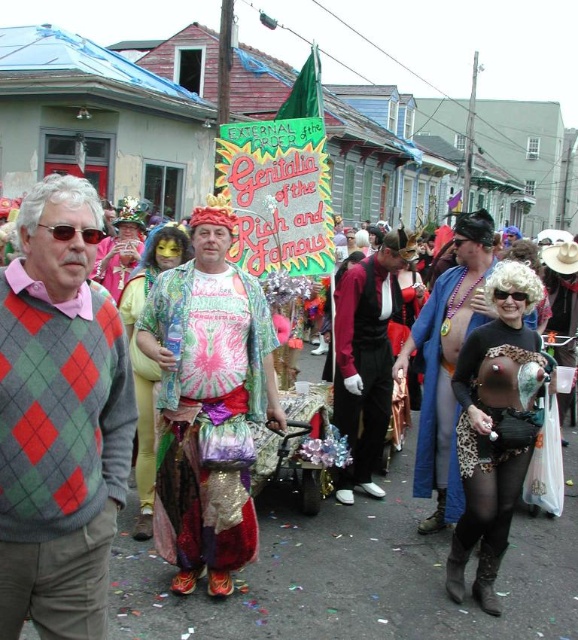
Which is more to the right, velvet black vest at center or shiny pink sequins at center?

velvet black vest at center is more to the right.

Can you confirm if velvet black vest at center is positioned below shiny pink sequins at center?

Correct, velvet black vest at center is located below shiny pink sequins at center.

Is point (355, 404) closer to camera compared to point (105, 243)?

Yes, point (355, 404) is in front of point (105, 243).

Identify the location of velvet black vest at center. The image size is (578, 640). (365, 358).

Is point (25, 499) positioned in front of point (435, 374)?

Yes, point (25, 499) is closer to viewer.

Is argyle sweater at left shorter than leopard print dress at center?

Correct, argyle sweater at left is not as tall as leopard print dress at center.

Which is in front, point (45, 420) or point (428, 451)?

Positioned in front is point (45, 420).

Where is `argyle sweater at left`? The height and width of the screenshot is (640, 578). argyle sweater at left is located at coordinates (60, 419).

Identify the location of velvet black vest at center. (365, 358).

Does point (379, 381) come in front of point (457, 493)?

No, it is not.

Find the location of a particular element. velvet black vest at center is located at coordinates (365, 358).